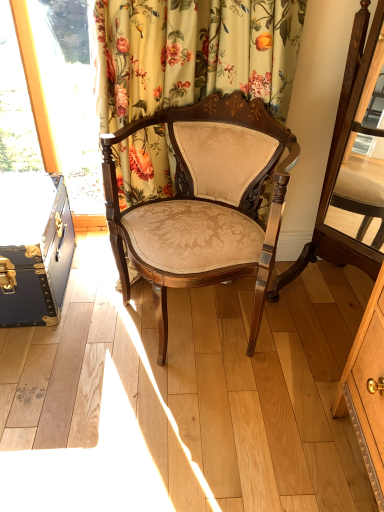
Where is `free space between matte brown wood swivel chair at center and matte gold upholstery chair at center`? The height and width of the screenshot is (512, 384). free space between matte brown wood swivel chair at center and matte gold upholstery chair at center is located at coordinates (298, 348).